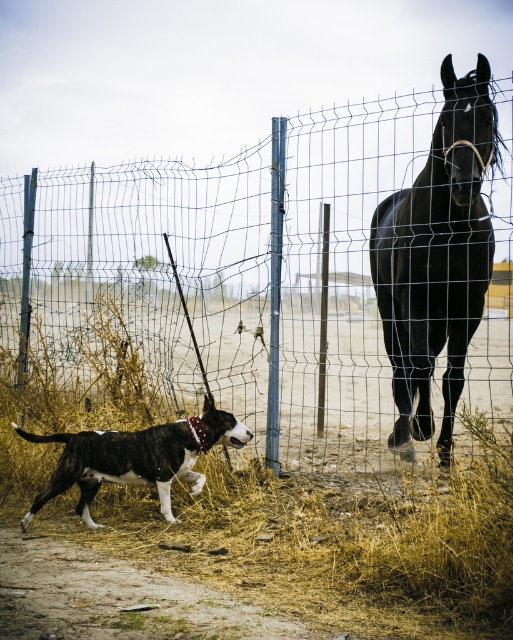
You are a farmer checking the fence between the wire mesh fence at center and the black glossy horse at right. Is the fence tall enough to prevent the horse from jumping over it?

The wire mesh fence at center is taller than the black glossy horse at right, so the fence is tall enough to prevent the horse from jumping over it.